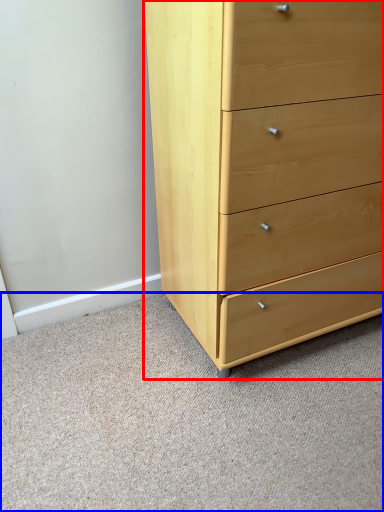
Question: Which of the following is the closest to the observer, chest of drawers (highlighted by a red box) or plain (highlighted by a blue box)?

Choices:
 (A) chest of drawers
 (B) plain

Answer: (B)